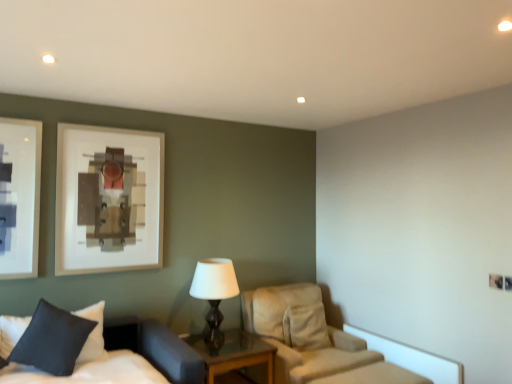
Question: From a real-world perspective, is white soft bed at lower left on dark blue fabric pillow at lower left?

Choices:
 (A) yes
 (B) no

Answer: (B)

Question: Considering the relative sizes of white soft bed at lower left and dark blue fabric pillow at lower left in the image provided, is white soft bed at lower left taller than dark blue fabric pillow at lower left?

Choices:
 (A) no
 (B) yes

Answer: (B)

Question: Considering the relative sizes of white soft bed at lower left and dark blue fabric pillow at lower left in the image provided, is white soft bed at lower left shorter than dark blue fabric pillow at lower left?

Choices:
 (A) yes
 (B) no

Answer: (B)

Question: Is white soft bed at lower left oriented towards dark blue fabric pillow at lower left?

Choices:
 (A) no
 (B) yes

Answer: (A)

Question: From a real-world perspective, is white soft bed at lower left positioned under dark blue fabric pillow at lower left based on gravity?

Choices:
 (A) yes
 (B) no

Answer: (A)

Question: Is white soft bed at lower left far from dark blue fabric pillow at lower left?

Choices:
 (A) no
 (B) yes

Answer: (A)

Question: From a real-world perspective, is wooden glass top nightstand at center below matte black table lamp at center?

Choices:
 (A) no
 (B) yes

Answer: (B)

Question: From the image's perspective, is wooden glass top nightstand at center beneath matte black table lamp at center?

Choices:
 (A) yes
 (B) no

Answer: (A)

Question: Is wooden glass top nightstand at center smaller than matte black table lamp at center?

Choices:
 (A) no
 (B) yes

Answer: (A)

Question: Would you say matte black table lamp at center is part of wooden glass top nightstand at center's contents?

Choices:
 (A) no
 (B) yes

Answer: (A)

Question: Does wooden glass top nightstand at center turn towards matte black table lamp at center?

Choices:
 (A) no
 (B) yes

Answer: (A)

Question: Is the position of wooden glass top nightstand at center more distant than that of matte black table lamp at center?

Choices:
 (A) yes
 (B) no

Answer: (B)

Question: From the image's perspective, does dark blue fabric pillow at lower left appear lower than wooden glass top nightstand at center?

Choices:
 (A) yes
 (B) no

Answer: (B)